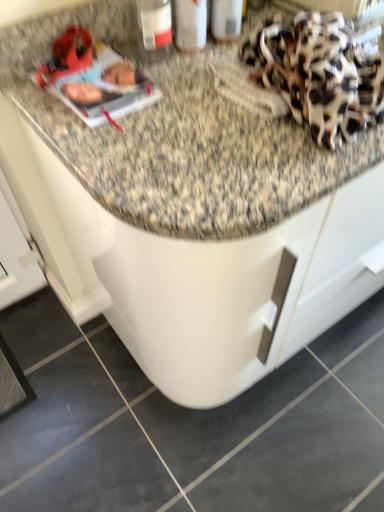
Question: From a real-world perspective, relative to matte plastic bottle at upper center, is matte plastic magazine at upper left vertically above or below?

Choices:
 (A) below
 (B) above

Answer: (A)

Question: Would you say matte plastic magazine at upper left is inside or outside matte plastic bottle at upper center?

Choices:
 (A) inside
 (B) outside

Answer: (B)

Question: Which is farther from the matte plastic bottle at upper center?

Choices:
 (A) matte plastic magazine at upper left
 (B) leopard print fabric at upper right

Answer: (B)

Question: Considering the real-world distances, which object is closest to the leopard print fabric at upper right?

Choices:
 (A) matte plastic magazine at upper left
 (B) matte plastic bottle at upper center

Answer: (A)